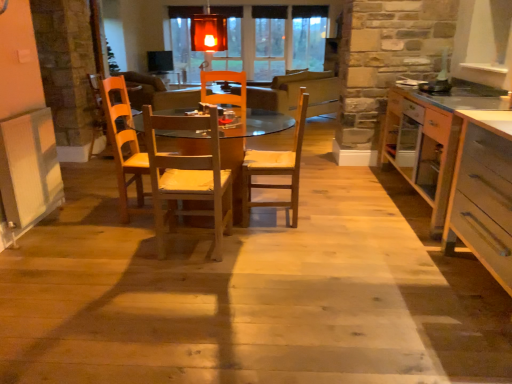
Locate an element on the screen. This screenshot has width=512, height=384. free space in front of wooden table at center is located at coordinates (229, 312).